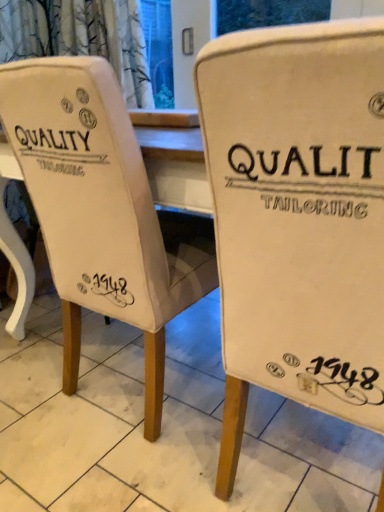
Question: Is white canvas chair at center in front of or behind white fabric chair at center, the second chair viewed from the right, in the image?

Choices:
 (A) front
 (B) behind

Answer: (A)

Question: Would you say white canvas chair at center is to the left or to the right of white fabric chair at center, the first chair in the left-to-right sequence, in the picture?

Choices:
 (A) left
 (B) right

Answer: (A)

Question: Which object is the farthest from the white fabric chair at center, the second chair viewed from the right?

Choices:
 (A) beige fabric chair at center, the first chair from the right
 (B) white canvas chair at center

Answer: (B)

Question: Which object is positioned closest to the white fabric chair at center, the first chair in the left-to-right sequence?

Choices:
 (A) white canvas chair at center
 (B) beige fabric chair at center, the first chair from the right

Answer: (B)